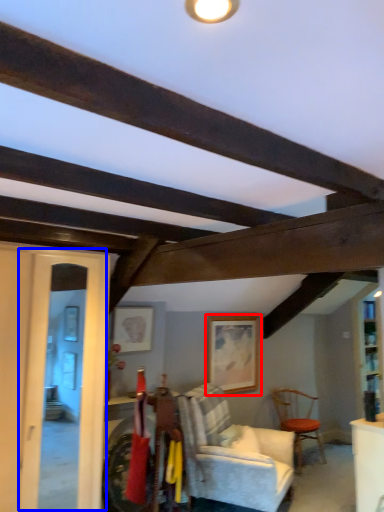
Question: Among these objects, which one is nearest to the camera, picture frame (highlighted by a red box) or glass door (highlighted by a blue box)?

Choices:
 (A) picture frame
 (B) glass door

Answer: (B)